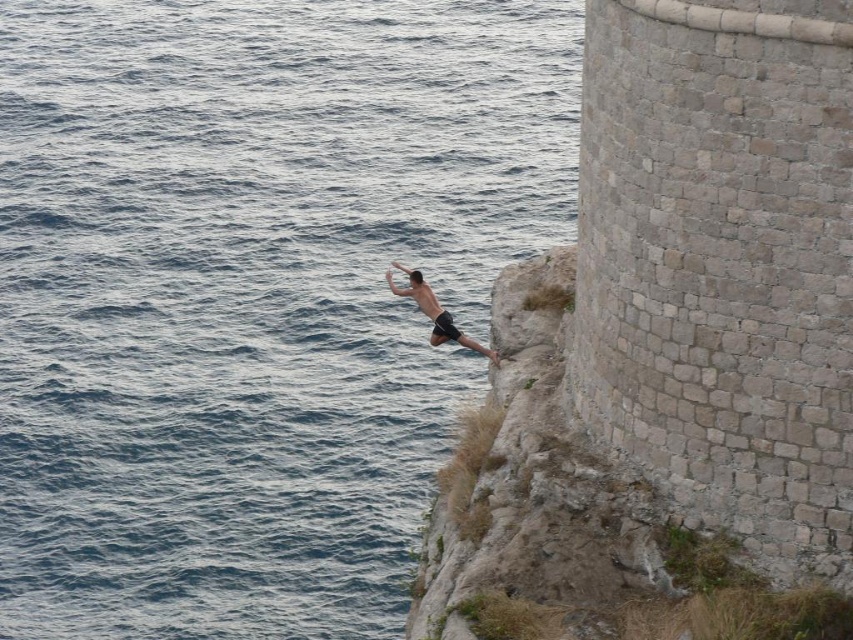
Does blue water at left appear on the left side of skinny black shorts at center?

Indeed, blue water at left is positioned on the left side of skinny black shorts at center.

Can you confirm if blue water at left is positioned above skinny black shorts at center?

Yes.

Locate an element on the screen. The height and width of the screenshot is (640, 853). blue water at left is located at coordinates (252, 294).